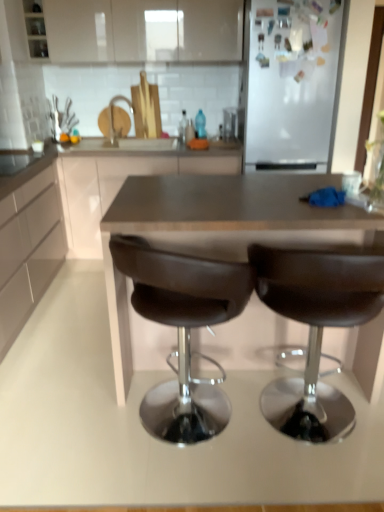
Locate an element on the screen. This screenshot has width=384, height=512. free space above brown leather chair at center, the 2th chair when ordered from left to right (from a real-world perspective) is located at coordinates (326, 217).